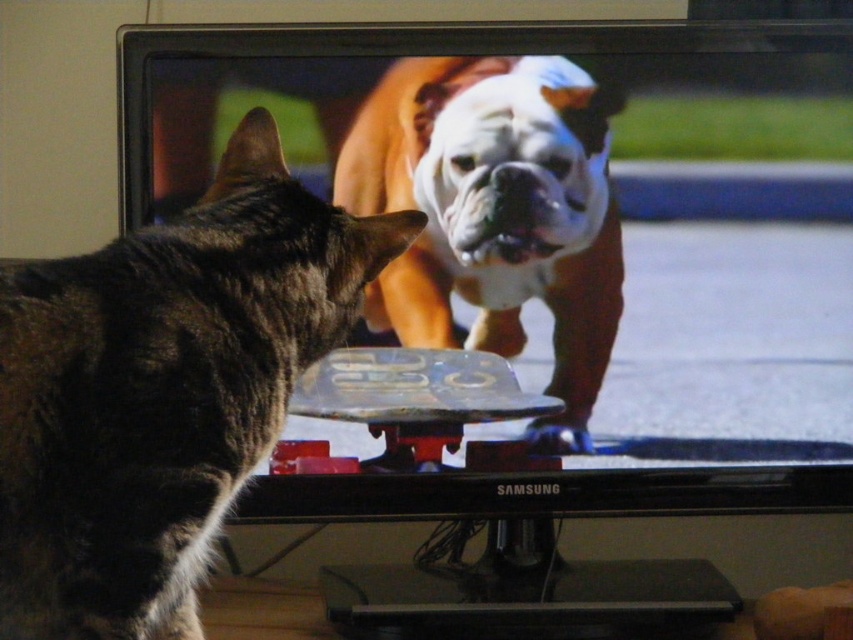
Question: Is dark brown fur cat at left wider than white fur dog at center?

Choices:
 (A) no
 (B) yes

Answer: (A)

Question: Can you confirm if dark brown fur cat at left is positioned to the left of white fur dog at center?

Choices:
 (A) no
 (B) yes

Answer: (B)

Question: Can you confirm if dark brown fur cat at left is bigger than white fur dog at center?

Choices:
 (A) no
 (B) yes

Answer: (B)

Question: Which point is farther to the camera?

Choices:
 (A) (552, 74)
 (B) (340, 211)

Answer: (A)